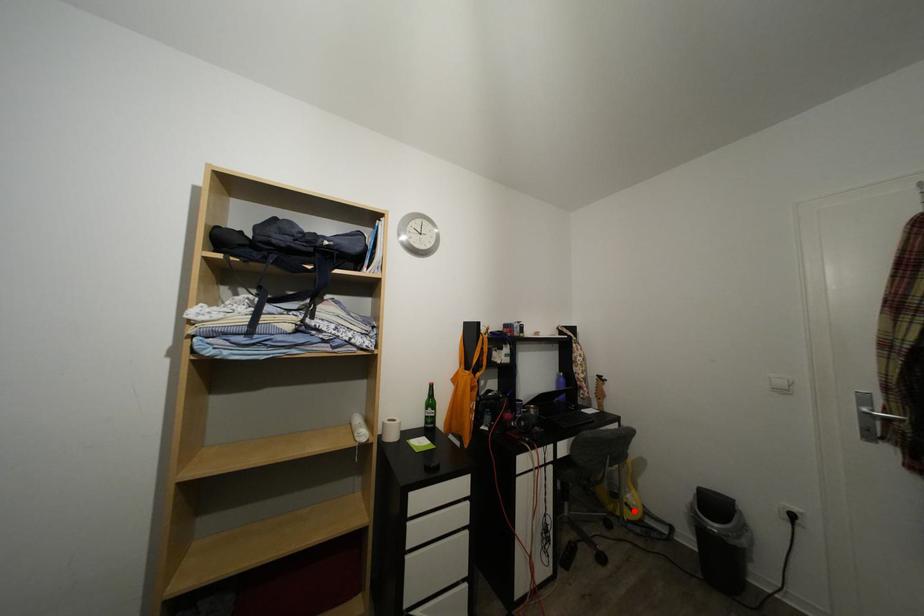
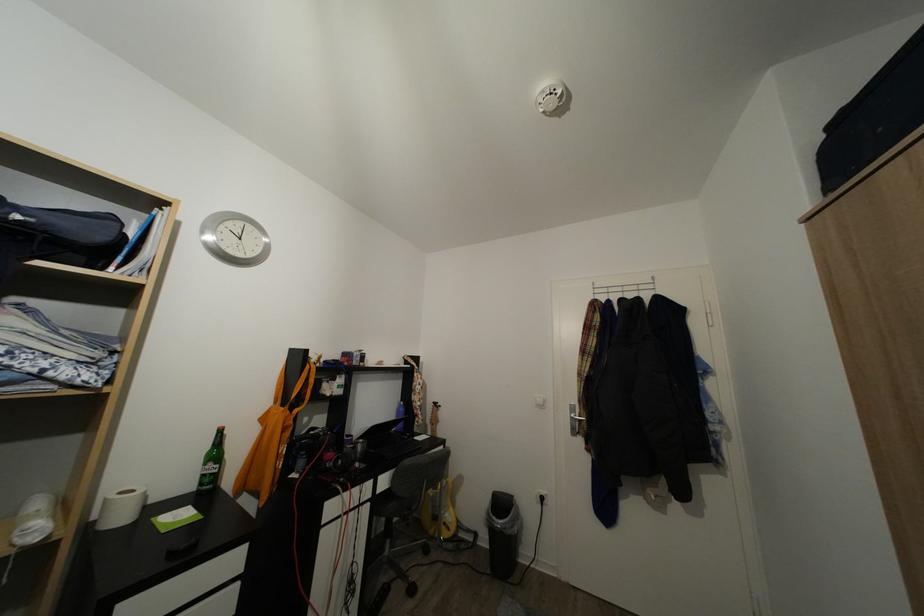
Question: I am providing you with two images of the same scene from different viewpoints. In image1, a red point is highlighted. Considering the same 3D point in image2, which of the following is correct?

Choices:
 (A) It is closer
 (B) It is farther

Answer: (B)